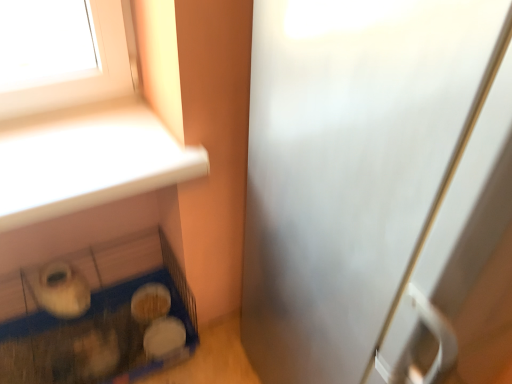
Question: Could you tell me if white matte food at lower left, which is counted as the 1th food, starting from the top, is facing satin silver screen door at right?

Choices:
 (A) yes
 (B) no

Answer: (B)

Question: Is white matte food at lower left, which is counted as the 1th food, starting from the top, outside of satin silver screen door at right?

Choices:
 (A) yes
 (B) no

Answer: (A)

Question: From a real-world perspective, is white matte food at lower left, which is the second food from bottom to top, positioned over satin silver screen door at right based on gravity?

Choices:
 (A) yes
 (B) no

Answer: (B)

Question: From a real-world perspective, is white matte food at lower left, which is the second food from bottom to top, under satin silver screen door at right?

Choices:
 (A) no
 (B) yes

Answer: (B)

Question: Is white matte food at lower left, which is counted as the 1th food, starting from the top, to the right of satin silver screen door at right from the viewer's perspective?

Choices:
 (A) no
 (B) yes

Answer: (A)

Question: Can you confirm if white matte food at lower left, which is counted as the 1th food, starting from the top, is smaller than satin silver screen door at right?

Choices:
 (A) yes
 (B) no

Answer: (A)

Question: Can you confirm if blue plastic bird cage at lower left is taller than satin silver screen door at right?

Choices:
 (A) yes
 (B) no

Answer: (B)

Question: Considering the relative sizes of blue plastic bird cage at lower left and satin silver screen door at right in the image provided, is blue plastic bird cage at lower left wider than satin silver screen door at right?

Choices:
 (A) no
 (B) yes

Answer: (A)

Question: Considering the relative sizes of blue plastic bird cage at lower left and satin silver screen door at right in the image provided, is blue plastic bird cage at lower left smaller than satin silver screen door at right?

Choices:
 (A) no
 (B) yes

Answer: (B)

Question: From a real-world perspective, is blue plastic bird cage at lower left on top of satin silver screen door at right?

Choices:
 (A) yes
 (B) no

Answer: (B)

Question: Could you tell me if blue plastic bird cage at lower left is turned towards satin silver screen door at right?

Choices:
 (A) yes
 (B) no

Answer: (B)

Question: Is satin silver screen door at right a part of blue plastic bird cage at lower left?

Choices:
 (A) no
 (B) yes

Answer: (A)

Question: Is satin silver screen door at right not within blue plastic bird cage at lower left?

Choices:
 (A) yes
 (B) no

Answer: (A)